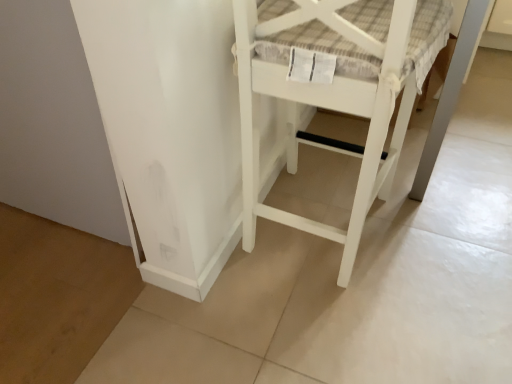
Locate an element on the screen. vacant space in front of white wood chair at center is located at coordinates (341, 326).